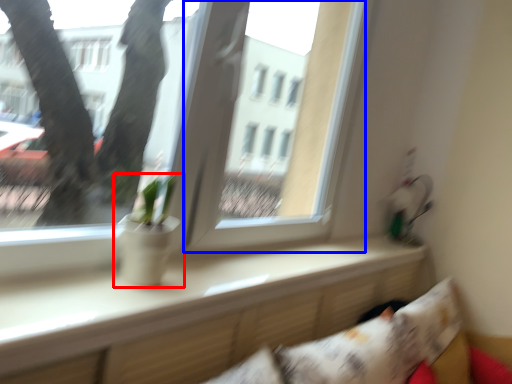
Question: Among these objects, which one is nearest to the camera, houseplant (highlighted by a red box) or window screen (highlighted by a blue box)?

Choices:
 (A) houseplant
 (B) window screen

Answer: (A)